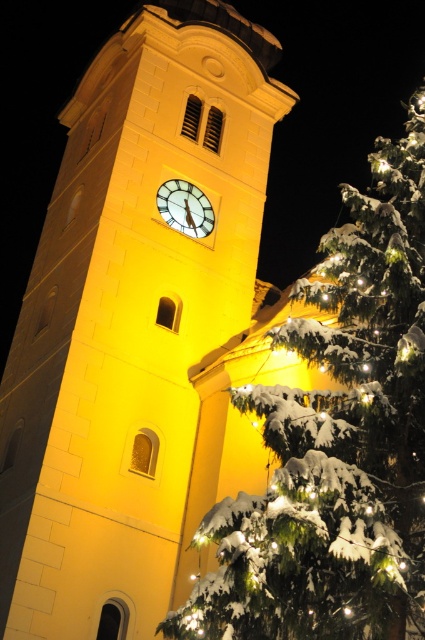
You are a maintenance worker who needs to reach both the yellow stone clock tower at center and the white glossy clock at center for cleaning. The ladder you have can extend up to 10 meters. Can you clean both objects with the same ladder without moving it?

The yellow stone clock tower at center and white glossy clock at center are 8.36 meters apart from each other. Since the ladder can extend up to 10 meters, which is longer than the distance between them, you can clean both objects with the same ladder without moving it.